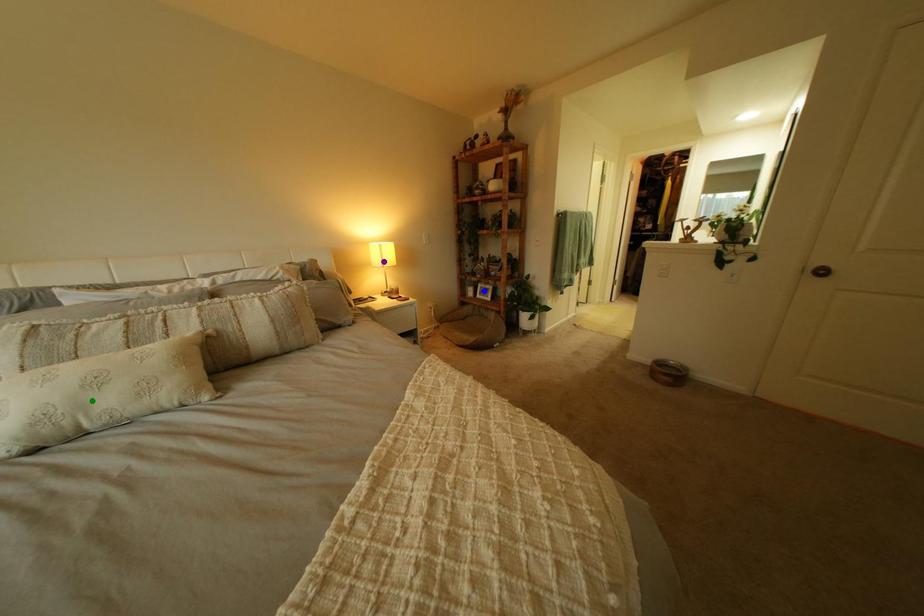
Looking at this image, order these from nearest to farthest:
purple point, blue point, green point

1. green point
2. purple point
3. blue point